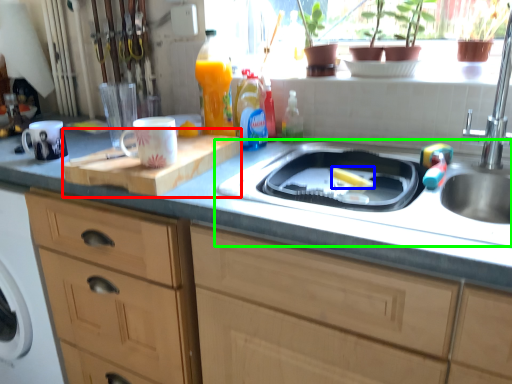
Question: Considering the real-world distances, which object is closest to cutting board (highlighted by a red box)? food (highlighted by a blue box) or sink (highlighted by a green box).

Choices:
 (A) food
 (B) sink

Answer: (B)